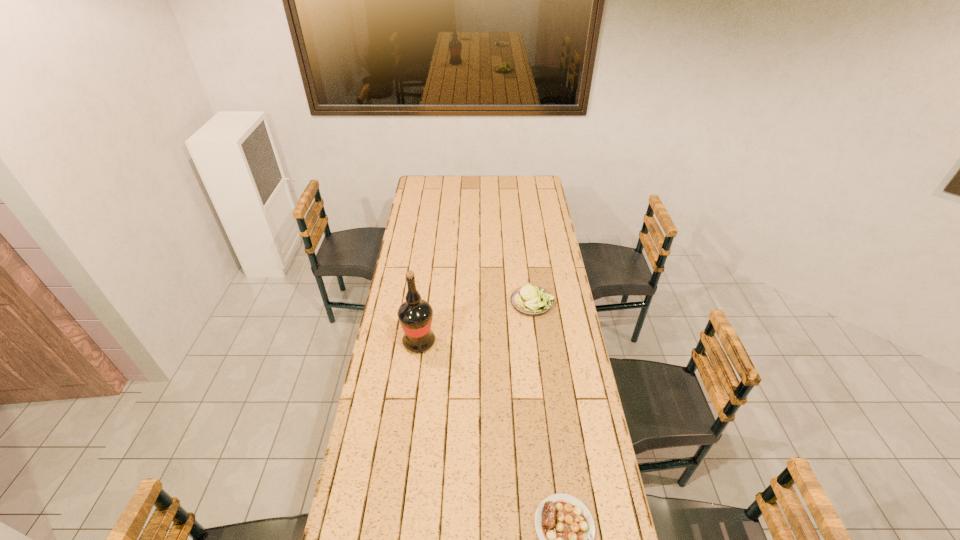
In the image, there is a desktop. Identify the location of free space at the far right corner. (546, 191).

Locate an element on the screen. Image resolution: width=960 pixels, height=540 pixels. vacant space in between the leftmost object and the second tallest object is located at coordinates (476, 322).

At what (x,y) coordinates should I click in order to perform the action: click on free spot between the tallest object and the farthest object. Please return your answer as a coordinate pair (x, y). This screenshot has width=960, height=540. Looking at the image, I should click on (476, 322).

The image size is (960, 540). In order to click on vacant point located between the tallest object and the second tallest object in this screenshot , I will do `click(476, 322)`.

Identify the location of object that is the second closest to the second farthest object. Image resolution: width=960 pixels, height=540 pixels. (565, 527).

Select which object appears as the second closest to the nearest object. Please provide its 2D coordinates. Your answer should be formatted as a tuple, i.e. [(x, y)], where the tuple contains the x and y coordinates of a point satisfying the conditions above.

[(529, 300)]